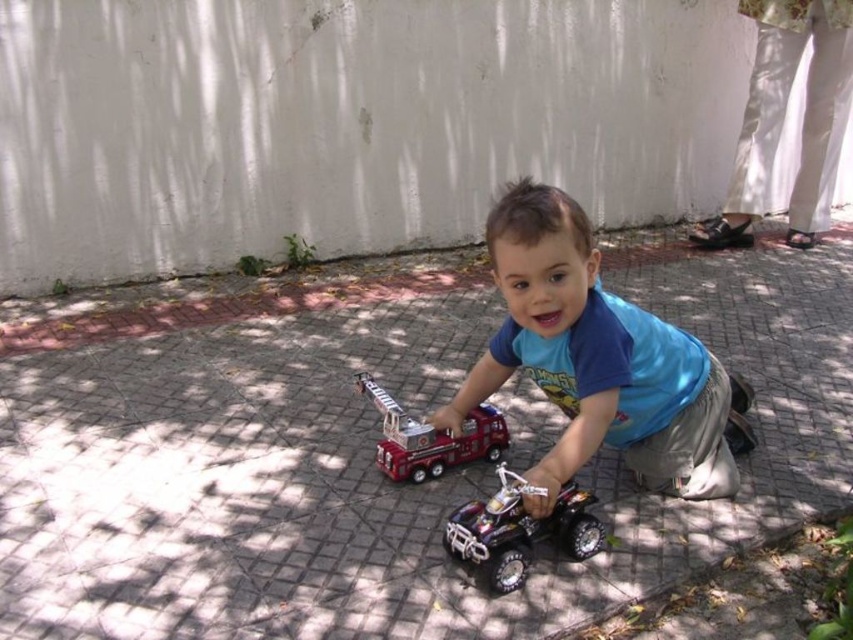
You are a parent trying to ensure your child can easily reach their toys. The gray brick pavement at center and metallic silver quad bike at center are both in the play area. Which object is taller, making it potentially harder for the child to see over?

The gray brick pavement at center is taller than the metallic silver quad bike at center, so it might be harder for the child to see over the gray brick pavement at center.

You are a parent watching your child play with the metallic silver quad bike at center and the shiny red fire truck at center. Which toy is casting a shadow over the other?

The metallic silver quad bike at center is positioned under the shiny red fire truck at center, so the fire truck is casting its shadow over the quad bike.

You are a parent trying to fit both the metallic silver quad bike at center and the shiny red fire truck at center into a rectangular storage box. The box is just wide enough to fit the narrower of the two. Which toy should you place in the box first to ensure both fit?

The metallic silver quad bike at center is thinner than the shiny red fire truck at center, so you should place the metallic silver quad bike at center first to ensure both fit in the box.